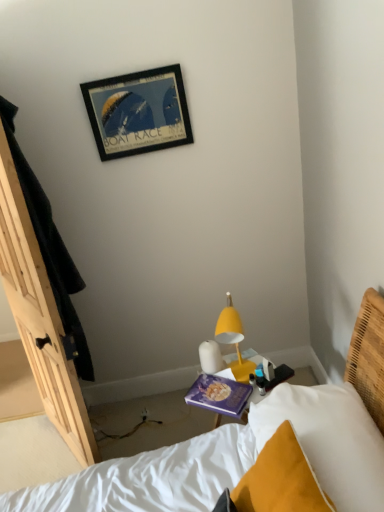
The height and width of the screenshot is (512, 384). Describe the element at coordinates (233, 340) in the screenshot. I see `yellow matte lamp at center-right` at that location.

Where is `white soft pillow at lower right`? The image size is (384, 512). white soft pillow at lower right is located at coordinates (326, 440).

Could you tell me if black matte picture frame at upper center is facing purple matte book at center?

No, black matte picture frame at upper center is not facing towards purple matte book at center.

Is purple matte book at center completely or partially inside black matte picture frame at upper center?

No.

Who is taller, black matte picture frame at upper center or purple matte book at center?

black matte picture frame at upper center.

From the image's perspective, which is below, black matte picture frame at upper center or purple matte book at center?

purple matte book at center appears lower in the image.

Is the position of white soft pillow at lower right less distant than that of yellow matte lamp at center-right?

Yes, white soft pillow at lower right is closer to the camera.

From a real-world perspective, between white soft pillow at lower right and yellow matte lamp at center-right, who is vertically higher?

yellow matte lamp at center-right.

From their relative heights in the image, would you say white soft pillow at lower right is taller or shorter than yellow matte lamp at center-right?

Considering their sizes, white soft pillow at lower right has more height than yellow matte lamp at center-right.

Does white soft pillow at lower right lie behind purple matte book at center?

No, the depth of white soft pillow at lower right is less than that of purple matte book at center.

Would you say white soft pillow at lower right is a long distance from purple matte book at center?

No, white soft pillow at lower right is not far from purple matte book at center.

From the image's perspective, is white soft pillow at lower right located above purple matte book at center?

No, from the image's perspective, white soft pillow at lower right is not over purple matte book at center.

Does white soft pillow at lower right have a smaller size compared to purple matte book at center?

Actually, white soft pillow at lower right might be larger than purple matte book at center.

Considering the sizes of objects black matte picture frame at upper center and white soft pillow at lower right in the image provided, who is thinner, black matte picture frame at upper center or white soft pillow at lower right?

Thinner between the two is black matte picture frame at upper center.

Between black matte picture frame at upper center and white soft pillow at lower right, which one appears on the left side from the viewer's perspective?

Positioned to the left is black matte picture frame at upper center.

Which is further, (190, 127) or (248, 461)?

Point (190, 127)

How different are the orientations of black matte picture frame at upper center and white soft pillow at lower right in degrees?

They differ by 97.2 degrees in their facing directions.

How distant is black matte picture frame at upper center from yellow matte lamp at center-right?

They are 38.76 inches apart.

Between black matte picture frame at upper center and yellow matte lamp at center-right, which one appears on the right side from the viewer's perspective?

yellow matte lamp at center-right.

Locate an element on the screen. This screenshot has height=512, width=384. lamp below the black matte picture frame at upper center (from a real-world perspective) is located at coordinates (233, 340).

Looking at this image, from a real-world perspective, is black matte picture frame at upper center positioned above or below yellow matte lamp at center-right?

In terms of real-world spatial position, black matte picture frame at upper center is above yellow matte lamp at center-right.

Is yellow matte lamp at center-right outside of white soft pillow at lower right?

Yes, yellow matte lamp at center-right is not within white soft pillow at lower right.

Is yellow matte lamp at center-right far away from white soft pillow at lower right?

No, yellow matte lamp at center-right is not far away from white soft pillow at lower right.

Is point (223, 332) positioned in front of point (366, 426)?

No, (223, 332) is further to viewer.

From a real-world perspective, who is located higher, yellow matte lamp at center-right or white soft pillow at lower right?

yellow matte lamp at center-right is physically above.

From the image's perspective, which is above, purple matte book at center or black matte picture frame at upper center?

black matte picture frame at upper center, from the image's perspective.

Could you tell me if purple matte book at center is facing black matte picture frame at upper center?

No.

Is purple matte book at center at the left side of black matte picture frame at upper center?

No, purple matte book at center is not to the left of black matte picture frame at upper center.

Is purple matte book at center positioned behind black matte picture frame at upper center?

No, it is not.

The height and width of the screenshot is (512, 384). In order to click on picture frame on the left of purple matte book at center in this screenshot , I will do `click(138, 112)`.

At what (x,y) coordinates should I click in order to perform the action: click on lamp that is above the white soft pillow at lower right (from the image's perspective). Please return your answer as a coordinate pair (x, y). Looking at the image, I should click on (233, 340).

Looking at the image, which one is located closer to black matte picture frame at upper center, yellow matte lamp at center-right or white soft pillow at lower right?

Based on the image, yellow matte lamp at center-right appears to be nearer to black matte picture frame at upper center.

When comparing their distances from black matte picture frame at upper center, does purple matte book at center or white soft pillow at lower right seem further?

white soft pillow at lower right is further to black matte picture frame at upper center.

Considering their positions, is white soft pillow at lower right positioned closer to purple matte book at center than black matte picture frame at upper center?

white soft pillow at lower right.

Estimate the real-world distances between objects in this image. Which object is closer to purple matte book at center, black matte picture frame at upper center or white soft pillow at lower right?

white soft pillow at lower right.

Looking at the image, which one is located closer to yellow matte lamp at center-right, white soft pillow at lower right or black matte picture frame at upper center?

white soft pillow at lower right is positioned closer to the anchor yellow matte lamp at center-right.

Considering their positions, is purple matte book at center positioned closer to yellow matte lamp at center-right than white soft pillow at lower right?

Based on the image, purple matte book at center appears to be nearer to yellow matte lamp at center-right.

Looking at the image, which one is located further to black matte picture frame at upper center, white soft pillow at lower right or yellow matte lamp at center-right?

Among the two, white soft pillow at lower right is located further to black matte picture frame at upper center.

When comparing their distances from purple matte book at center, does yellow matte lamp at center-right or white soft pillow at lower right seem closer?

Based on the image, yellow matte lamp at center-right appears to be nearer to purple matte book at center.

At what (x,y) coordinates should I click in order to perform the action: click on lamp between black matte picture frame at upper center and purple matte book at center vertically. Please return your answer as a coordinate pair (x, y). The height and width of the screenshot is (512, 384). Looking at the image, I should click on (233, 340).

Locate an element on the screen. book that lies between black matte picture frame at upper center and white soft pillow at lower right from top to bottom is located at coordinates (219, 395).

What are the coordinates of `lamp positioned between white soft pillow at lower right and purple matte book at center from near to far` in the screenshot? It's located at (233, 340).

I want to click on lamp between black matte picture frame at upper center and white soft pillow at lower right in the up-down direction, so click(233, 340).